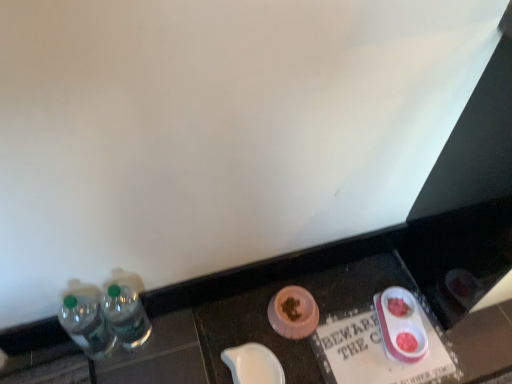
Question: Considering their positions, is clear plastic bottles at left, the 2th bottle viewed from the left, located in front of or behind white paper sign at lower center?

Choices:
 (A) front
 (B) behind

Answer: (A)

Question: Is clear plastic bottles at left, which is counted as the first bottle, starting from the right, taller or shorter than white paper sign at lower center?

Choices:
 (A) short
 (B) tall

Answer: (B)

Question: Which is farther from the white glossy bowl at lower center, the 2th tableware positioned from the right?

Choices:
 (A) white paper sign at lower center
 (B) clear plastic bottles at left, the 1th bottle viewed from the left
 (C) pink plastic food bowls at lower right, arranged as the 1th tableware when viewed from the right
 (D) clear plastic bottles at left
 (E) clear plastic bottles at left, the 2th bottle viewed from the left

Answer: (B)

Question: Considering the real-world distances, which object is closest to the white glossy bowl at lower center, the 2th tableware positioned from the right?

Choices:
 (A) clear plastic bottles at left, the 1th bottle viewed from the left
 (B) pink plastic food bowls at lower right, placed as the second tableware when sorted from left to right
 (C) white paper sign at lower center
 (D) clear plastic bottles at left, which is counted as the first bottle, starting from the right
 (E) clear plastic bottles at left

Answer: (C)